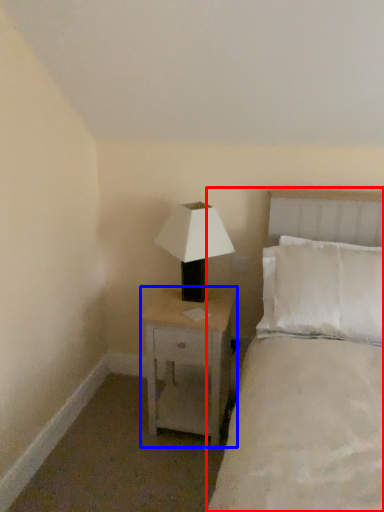
Question: Which of the following is the closest to the observer, bed (highlighted by a red box) or nightstand (highlighted by a blue box)?

Choices:
 (A) bed
 (B) nightstand

Answer: (A)